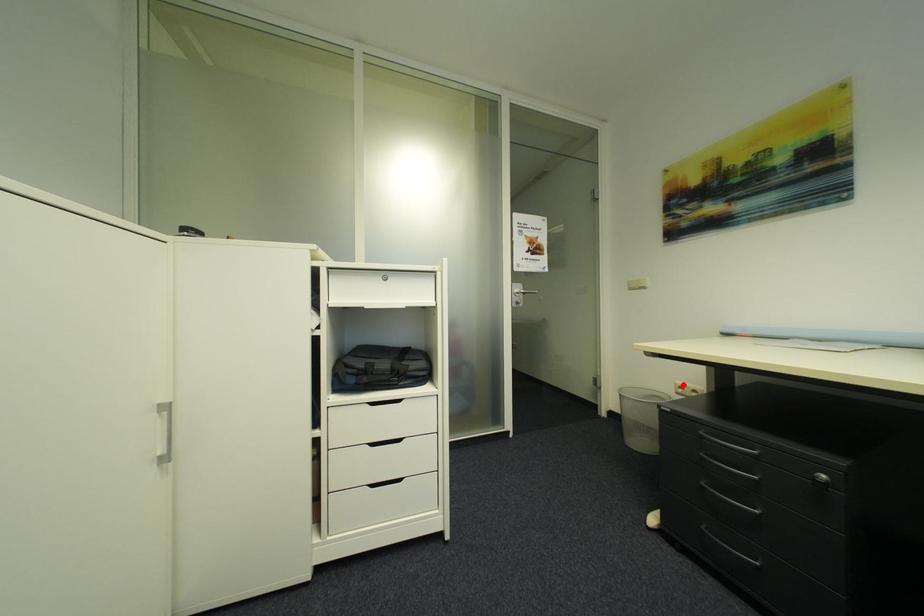
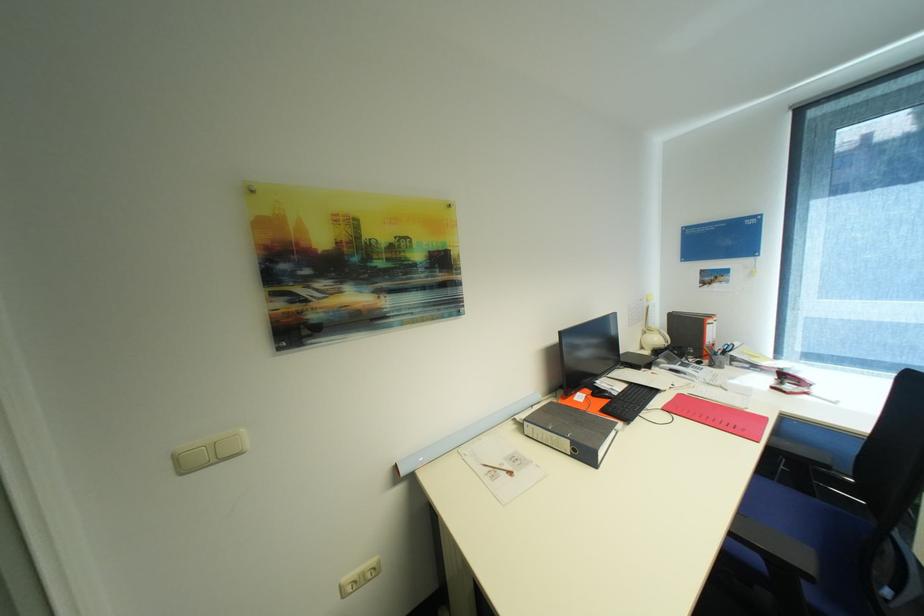
In the second image, find the point that corresponds to the highlighted location in the first image.

(348, 586)